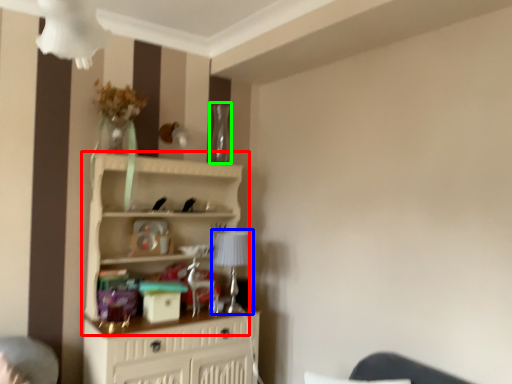
Question: Considering the real-world distances, which object is closest to shelf (highlighted by a red box)? table lamp (highlighted by a blue box) or glass vase (highlighted by a green box).

Choices:
 (A) table lamp
 (B) glass vase

Answer: (A)